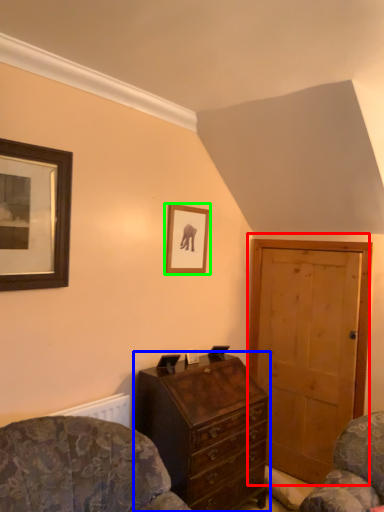
Question: Based on their relative distances, which object is nearer to door (highlighted by a red box)? Choose from chest of drawers (highlighted by a blue box) and picture frame (highlighted by a green box).

Choices:
 (A) chest of drawers
 (B) picture frame

Answer: (A)